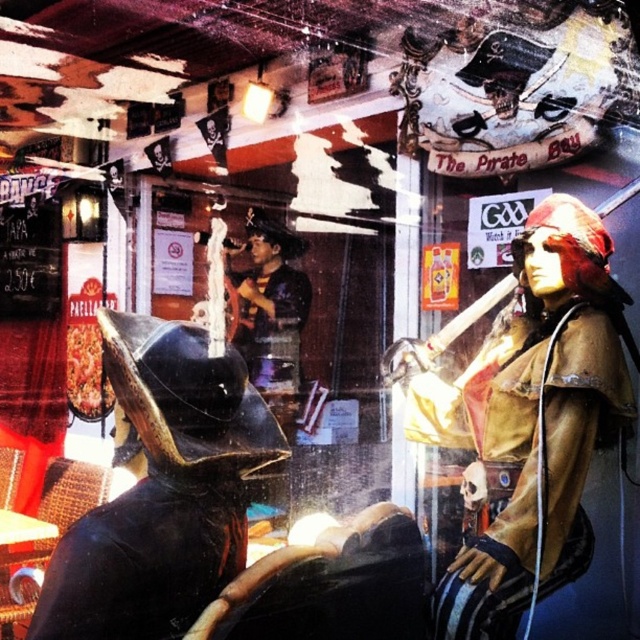
You are a customer entering the pirate bar and want to take a photo with the gold metallic pirate at center and the shiny black helmet at left. Since you want both in the frame, will the height difference between them be noticeable in the photo?

The gold metallic pirate at center is much taller than the shiny black helmet at left, so the height difference between them will be noticeable in the photo.

You are a customer standing at the entrance of the pirate bar and want to order a drink. The bartender tells you to look at the menu board located at the gold metallic pirate at center. Where should you look to find the menu board?

The menu board is located at the gold metallic pirate at center, which is positioned at coordinates point (544, 420). So you should look towards that specific location to find the menu board.

You are a customer entering the pirate bar and want to grab a closer look at the gold metallic pirate at center. If you walk forward 1 meter, will you be able to touch it?

The gold metallic pirate at center is 1.80 meters from viewer. After moving forward 1 meter, you will be 0.80 meters away, so yes, you can touch it.